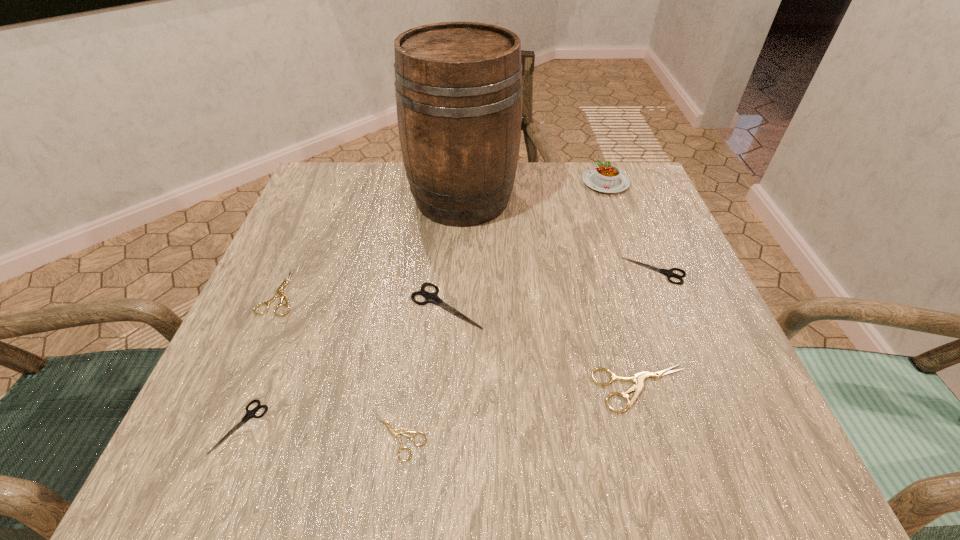
Identify the location of the tallest object. This screenshot has height=540, width=960. (458, 85).

Identify the location of pudding. The image size is (960, 540). (607, 178).

Where is `the tallest shears`? the tallest shears is located at coordinates (433, 298).

This screenshot has width=960, height=540. Identify the location of the sixth shortest object. (433, 298).

At what (x,y) coordinates should I click in order to perform the action: click on the second smallest black shears. Please return your answer as a coordinate pair (x, y). Looking at the image, I should click on (669, 273).

This screenshot has height=540, width=960. What are the coordinates of `the rightmost beige shears` in the screenshot? It's located at (638, 378).

Find the location of a particular element. Image resolution: width=960 pixels, height=540 pixels. the farthest beige shears is located at coordinates (279, 291).

At what (x,y) coordinates should I click in order to perform the action: click on the second biggest beige shears. Please return your answer as a coordinate pair (x, y). Image resolution: width=960 pixels, height=540 pixels. Looking at the image, I should click on (279, 291).

Locate an element on the screen. the smallest black shears is located at coordinates (249, 414).

Identify the location of the leftmost black shears. Image resolution: width=960 pixels, height=540 pixels. pyautogui.click(x=249, y=414).